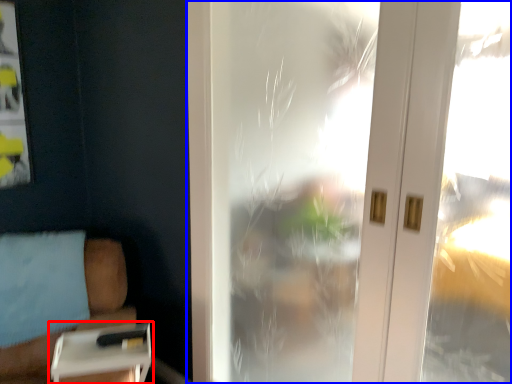
Question: Which object is closer to the camera taking this photo, table (highlighted by a red box) or window (highlighted by a blue box)?

Choices:
 (A) table
 (B) window

Answer: (B)